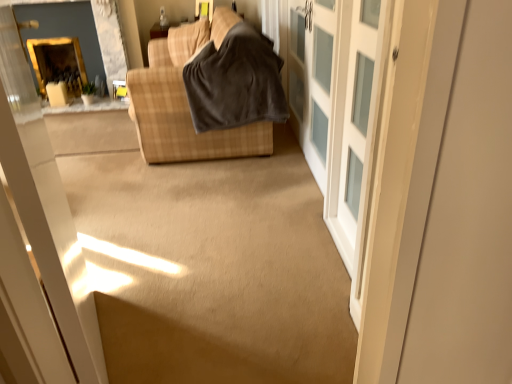
Question: Considering their positions, is white frosted glass cabinet at right located in front of or behind matte yellow window at upper center?

Choices:
 (A) front
 (B) behind

Answer: (A)

Question: Is white frosted glass cabinet at right bigger or smaller than matte yellow window at upper center?

Choices:
 (A) big
 (B) small

Answer: (A)

Question: Based on their relative distances, which object is farther from the brown plaid fabric couch at upper center?

Choices:
 (A) white frosted glass cabinet at right
 (B) white frosted glass barn door at center
 (C) dark gray fleece blanket at center
 (D) gold-framed mirror at upper left
 (E) matte yellow window at upper center

Answer: (D)

Question: Which object is positioned closest to the white frosted glass barn door at center?

Choices:
 (A) matte yellow window at upper center
 (B) gold-framed mirror at upper left
 (C) dark gray fleece blanket at center
 (D) white frosted glass cabinet at right
 (E) brown plaid fabric couch at upper center

Answer: (D)